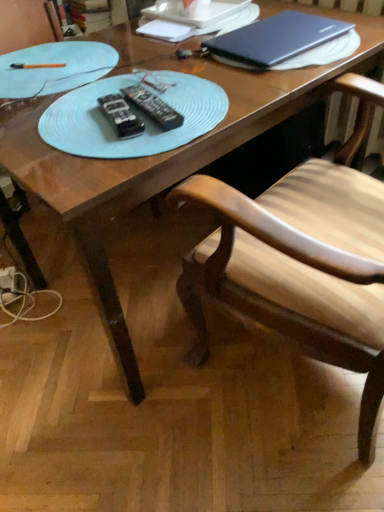
Question: Considering the positions of point (117, 54) and point (122, 97), is point (117, 54) closer or farther from the camera than point (122, 97)?

Choices:
 (A) farther
 (B) closer

Answer: (A)

Question: From the image's perspective, relative to black plastic remote at center, the first remote positioned from the left, is light blue plastic plate at upper left above or below?

Choices:
 (A) below
 (B) above

Answer: (B)

Question: Which object is positioned farthest from the satin black laptop at upper right?

Choices:
 (A) light blue plastic plate at upper left
 (B) black plastic remote at center, the first remote positioned from the left
 (C) black plastic remote at center, the first remote in the right-to-left sequence
 (D) wooden chair at center

Answer: (B)

Question: Which object is the closest to the light blue plastic plate at upper left?

Choices:
 (A) black plastic remote at center, which is the second remote in right-to-left order
 (B) wooden chair at center
 (C) satin black laptop at upper right
 (D) black plastic remote at center, the first remote in the right-to-left sequence

Answer: (D)